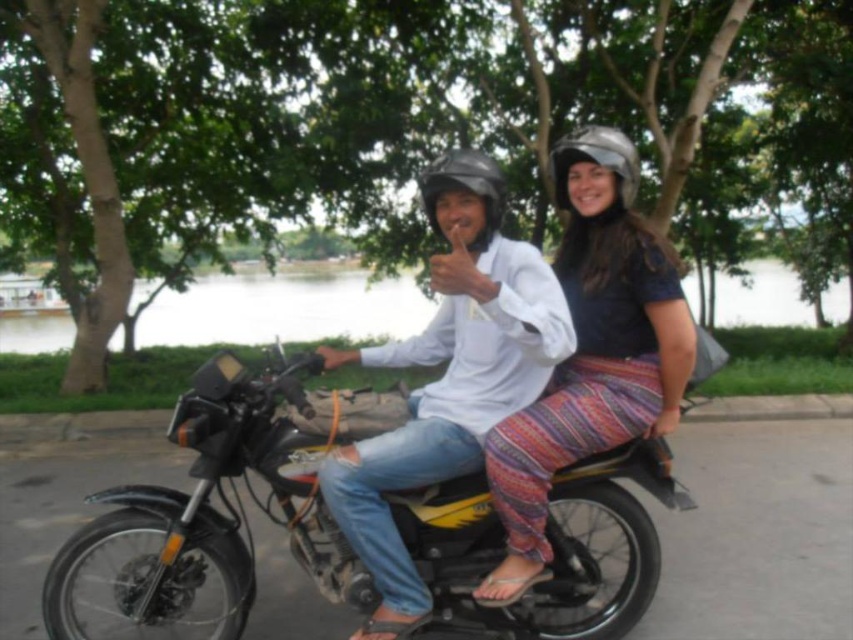
The width and height of the screenshot is (853, 640). What do you see at coordinates (212, 506) in the screenshot? I see `black matte motorcycle at center` at bounding box center [212, 506].

Does point (115, 524) come closer to viewer compared to point (689, 340)?

No, (115, 524) is behind (689, 340).

What do you see at coordinates (212, 506) in the screenshot? This screenshot has width=853, height=640. I see `black matte motorcycle at center` at bounding box center [212, 506].

I want to click on black matte motorcycle at center, so 212,506.

Does matte black helmet at center appear under metallic silver helmet at upper right?

Yes, matte black helmet at center is below metallic silver helmet at upper right.

Does point (480, 243) come closer to viewer compared to point (619, 136)?

Yes.

Describe the element at coordinates (463, 188) in the screenshot. I see `matte black helmet at center` at that location.

This screenshot has height=640, width=853. I want to click on matte black helmet at center, so click(463, 188).

Is black matte motorcycle at center to the right of matte black helmet at center from the viewer's perspective?

In fact, black matte motorcycle at center is to the left of matte black helmet at center.

Does black matte motorcycle at center have a smaller size compared to matte black helmet at center?

Incorrect, black matte motorcycle at center is not smaller in size than matte black helmet at center.

Identify the location of black matte motorcycle at center. (212, 506).

Where is `black matte motorcycle at center`? This screenshot has height=640, width=853. black matte motorcycle at center is located at coordinates (212, 506).